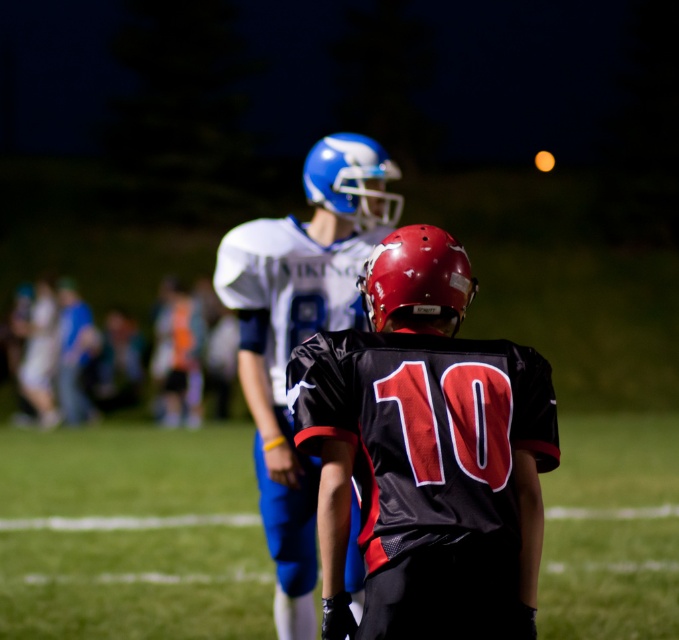
What do you see at coordinates (299, 333) in the screenshot? This screenshot has height=640, width=679. I see `white matte jersey at center` at bounding box center [299, 333].

Can you confirm if white matte jersey at center is shorter than shiny blue helmet at center?

Indeed, white matte jersey at center has a lesser height compared to shiny blue helmet at center.

Is point (295, 602) closer to camera compared to point (314, 145)?

That is True.

The image size is (679, 640). In order to click on white matte jersey at center in this screenshot , I will do `click(299, 333)`.

Can you confirm if green grass football field at center is positioned to the left of black mesh jersey at center?

Yes, green grass football field at center is to the left of black mesh jersey at center.

How distant is green grass football field at center from black mesh jersey at center?

They are 6.26 meters apart.

I want to click on green grass football field at center, so click(x=130, y=534).

Is the position of black mesh jersey at center less distant than that of shiny red helmet at center?

That is True.

What do you see at coordinates (426, 452) in the screenshot? I see `black mesh jersey at center` at bounding box center [426, 452].

Identify the location of black mesh jersey at center. The width and height of the screenshot is (679, 640). (426, 452).